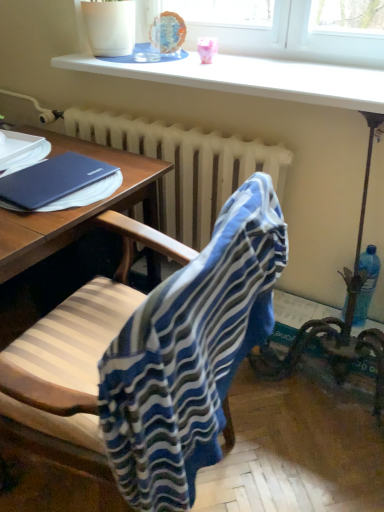
Question: Is blue plastic bottle at right oriented away from blue striped fabric at center?

Choices:
 (A) yes
 (B) no

Answer: (B)

Question: Is the depth of blue plastic bottle at right less than that of blue striped fabric at center?

Choices:
 (A) yes
 (B) no

Answer: (B)

Question: From the image's perspective, is blue plastic bottle at right under blue striped fabric at center?

Choices:
 (A) no
 (B) yes

Answer: (A)

Question: Considering the relative sizes of blue plastic bottle at right and blue striped fabric at center in the image provided, is blue plastic bottle at right wider than blue striped fabric at center?

Choices:
 (A) no
 (B) yes

Answer: (A)

Question: Is blue plastic bottle at right taller than blue striped fabric at center?

Choices:
 (A) no
 (B) yes

Answer: (A)

Question: Choose the correct answer: Is blue plastic bottle at right inside blue striped fabric at center or outside it?

Choices:
 (A) outside
 (B) inside

Answer: (A)

Question: Looking at their shapes, would you say blue plastic bottle at right is wider or thinner than blue striped fabric at center?

Choices:
 (A) wide
 (B) thin

Answer: (B)

Question: Is point (372, 287) closer or farther from the camera than point (215, 430)?

Choices:
 (A) farther
 (B) closer

Answer: (A)

Question: From the image's perspective, relative to blue striped fabric at center, is blue plastic bottle at right above or below?

Choices:
 (A) above
 (B) below

Answer: (A)

Question: Is blue striped fabric at center inside or outside of blue plastic bottle at right?

Choices:
 (A) inside
 (B) outside

Answer: (B)

Question: From their relative heights in the image, would you say blue striped fabric at center is taller or shorter than blue plastic bottle at right?

Choices:
 (A) tall
 (B) short

Answer: (A)

Question: Looking at their shapes, would you say blue striped fabric at center is wider or thinner than blue plastic bottle at right?

Choices:
 (A) thin
 (B) wide

Answer: (B)

Question: Is point (124, 442) closer or farther from the camera than point (360, 290)?

Choices:
 (A) farther
 (B) closer

Answer: (B)

Question: Is white radiator at center wider or thinner than blue striped fabric at center?

Choices:
 (A) wide
 (B) thin

Answer: (B)

Question: Is white radiator at center spatially inside blue striped fabric at center, or outside of it?

Choices:
 (A) inside
 (B) outside

Answer: (B)